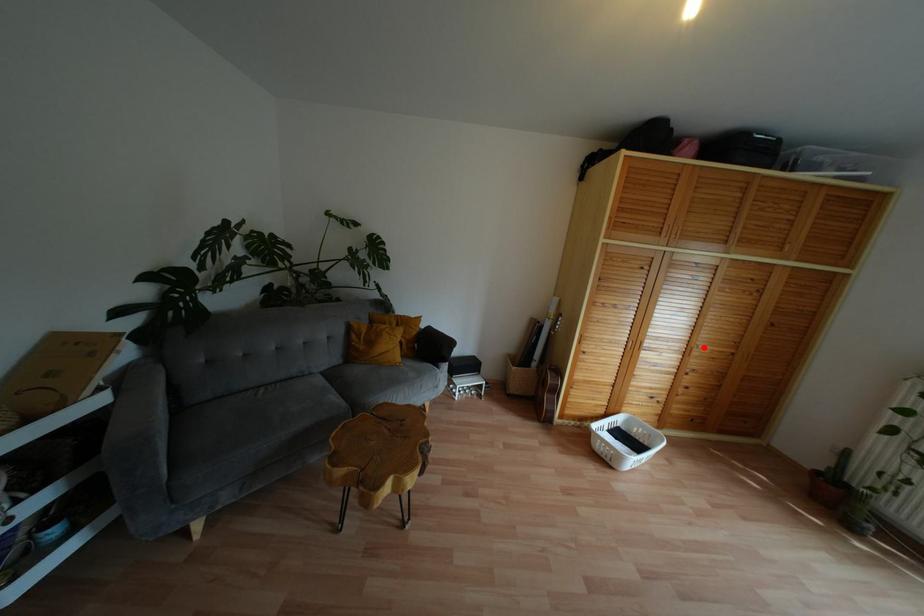
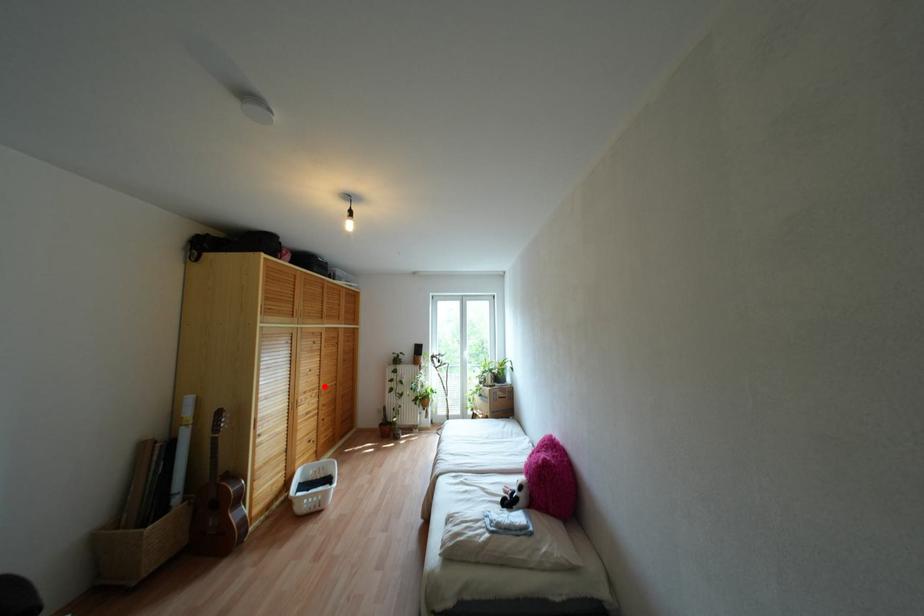
I am providing you with two images of the same scene from different viewpoints. A red point is marked on the first image and another point is marked on the second image. Is the marked point in image1 the same physical position as the marked point in image2?

Yes